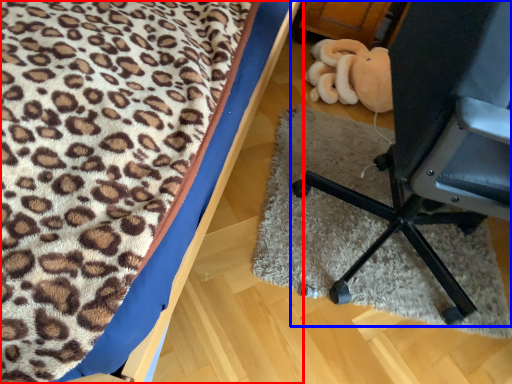
Question: Among these objects, which one is nearest to the camera, furniture (highlighted by a red box) or furniture (highlighted by a blue box)?

Choices:
 (A) furniture
 (B) furniture

Answer: (A)